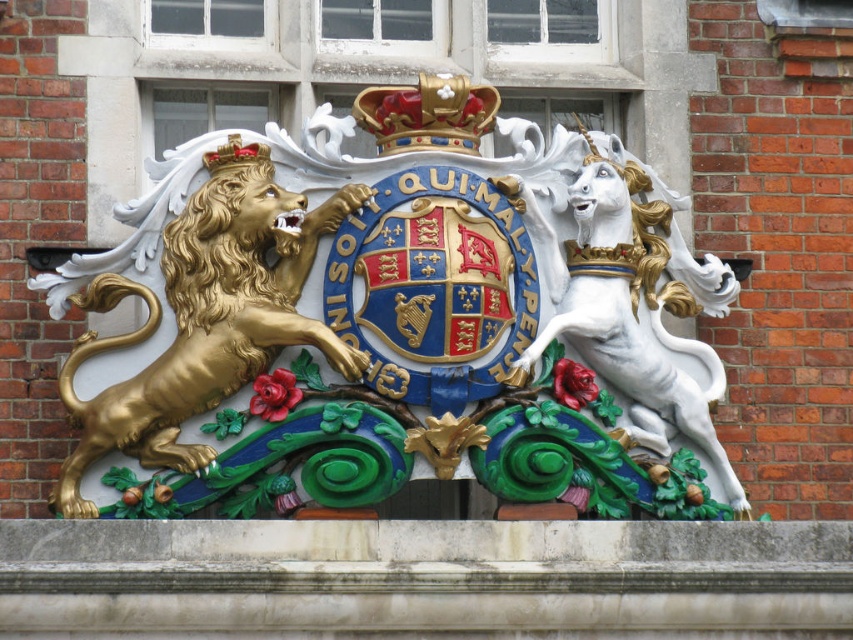
Question: Among these points, which one is nearest to the camera?

Choices:
 (A) (363, 353)
 (B) (579, 234)
 (C) (222, 154)
 (D) (412, 92)

Answer: (A)

Question: Does gold metallic lion at center appear on the left side of gold polished lion at left?

Choices:
 (A) yes
 (B) no

Answer: (B)

Question: Can you confirm if gold metallic lion at center is wider than gold jeweled crown at center?

Choices:
 (A) no
 (B) yes

Answer: (B)

Question: Which is nearer to the gold metallic lion at center?

Choices:
 (A) white glossy unicorn at right
 (B) gold polished lion at left

Answer: (B)

Question: Based on their relative distances, which object is nearer to the gold metallic lion at center?

Choices:
 (A) white glossy unicorn at right
 (B) gold metallic crown at upper center
 (C) gold polished lion at left

Answer: (B)

Question: Is the position of white glossy unicorn at right less distant than that of gold jeweled crown at center?

Choices:
 (A) yes
 (B) no

Answer: (B)